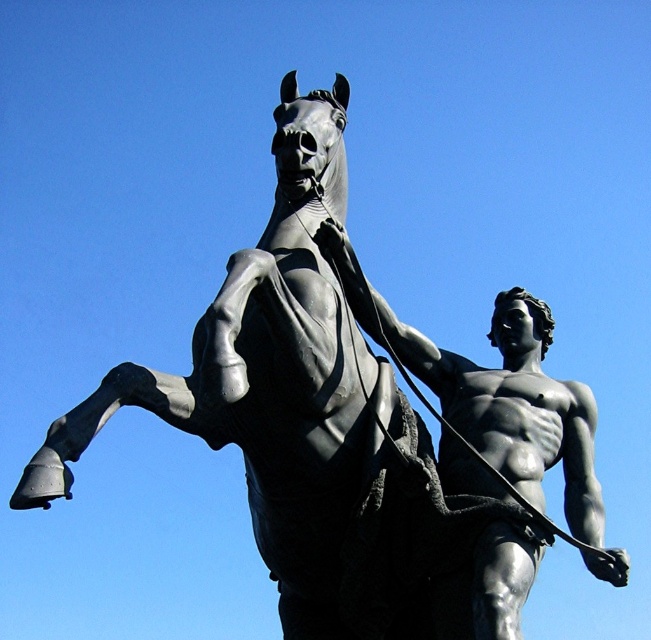
Between polished bronze horse at center and polished bronze statue at center, which one has more height?

polished bronze horse at center

Can you confirm if polished bronze horse at center is positioned to the left of polished bronze statue at center?

Yes, polished bronze horse at center is to the left of polished bronze statue at center.

Image resolution: width=651 pixels, height=640 pixels. I want to click on polished bronze horse at center, so click(266, 384).